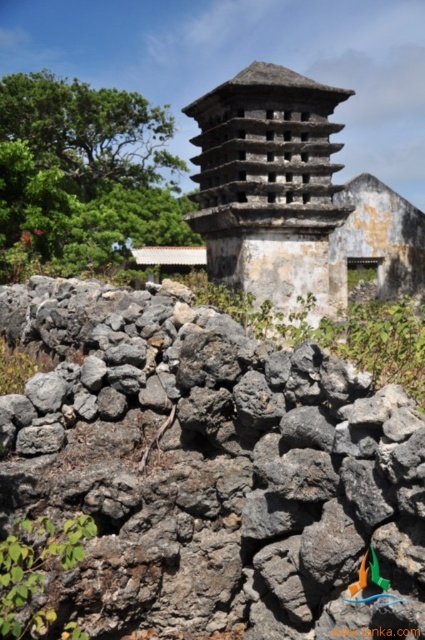
Does point (263, 518) come farther from viewer compared to point (254, 244)?

No, (263, 518) is in front of (254, 244).

Which is more to the left, volcanic rock wall at center or gray stone tower at center?

Positioned to the left is volcanic rock wall at center.

Which is in front, point (195, 342) or point (291, 282)?

Point (195, 342)

The width and height of the screenshot is (425, 640). I want to click on volcanic rock wall at center, so click(x=212, y=468).